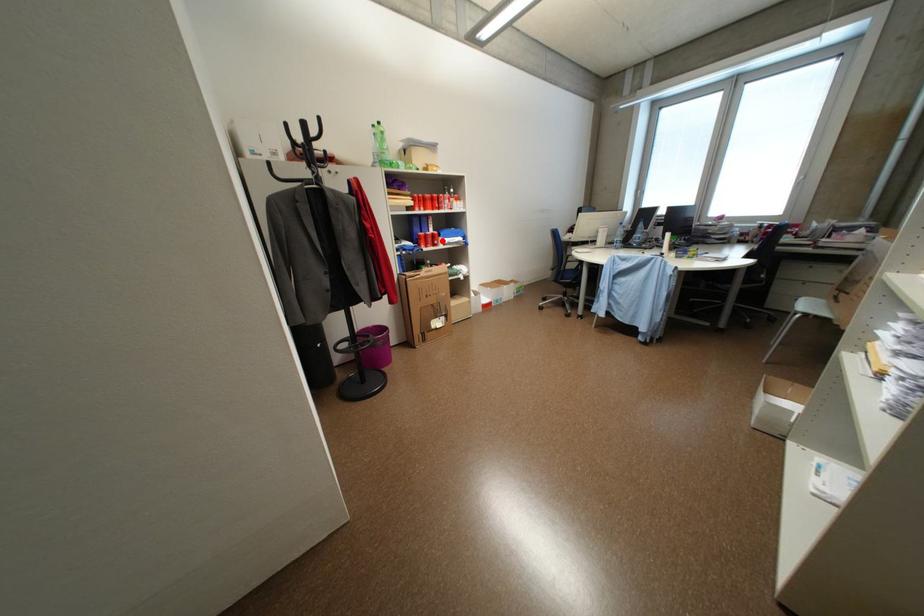
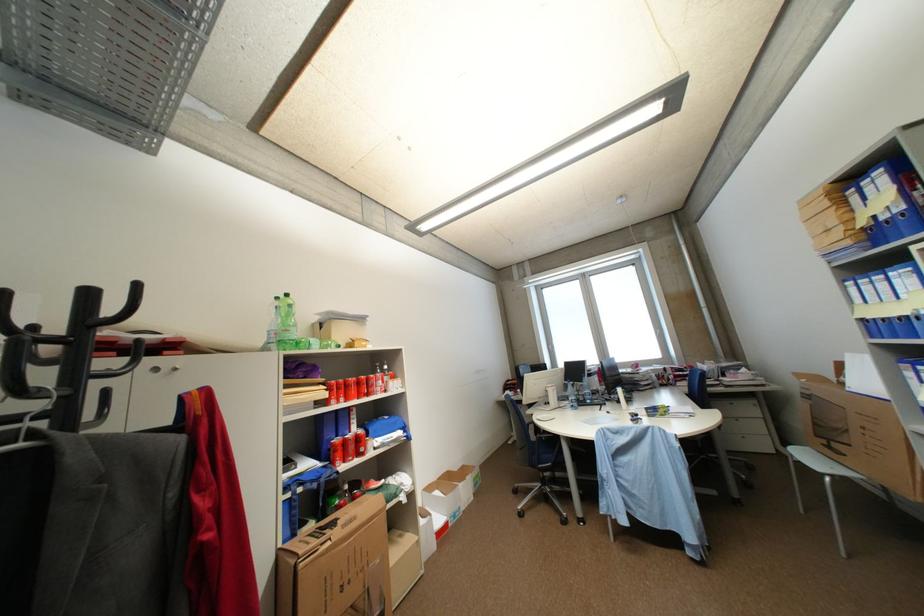
Question: I am providing you with two images of the same scene from different viewpoints. A red point is marked on the first image. Can you still see the location of the red point in image 2?

Choices:
 (A) Yes
 (B) No

Answer: (A)